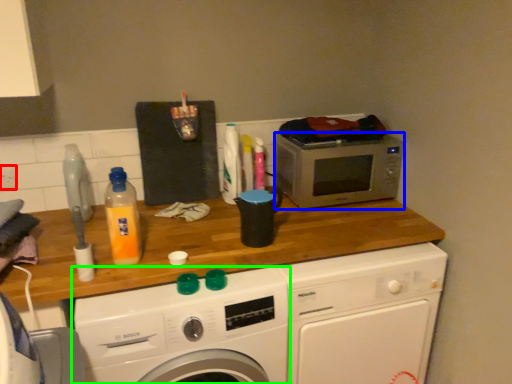
Question: Which object is the farthest from power plugs and sockets (highlighted by a red box)? Choose among these: microwave oven (highlighted by a blue box) or washing machine (highlighted by a green box).

Choices:
 (A) microwave oven
 (B) washing machine

Answer: (A)